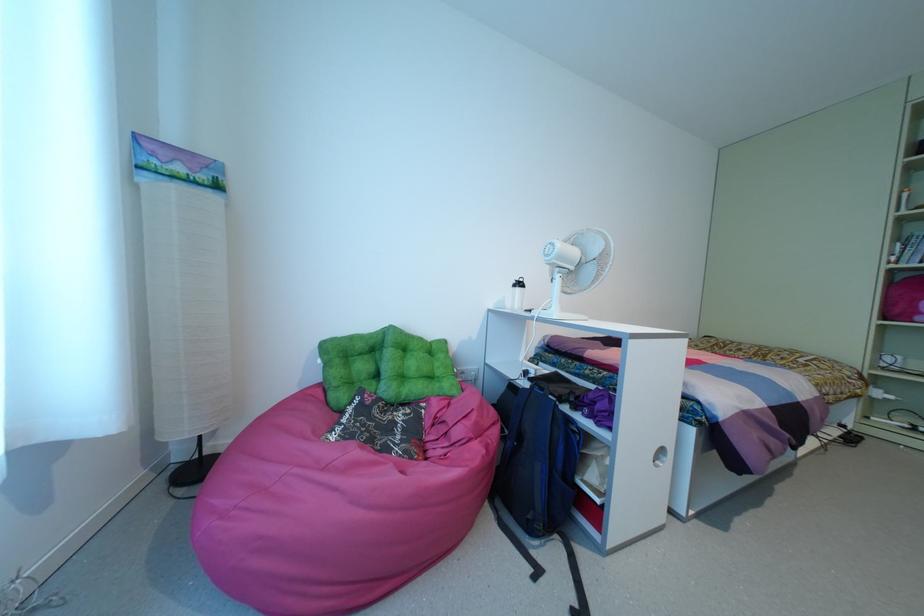
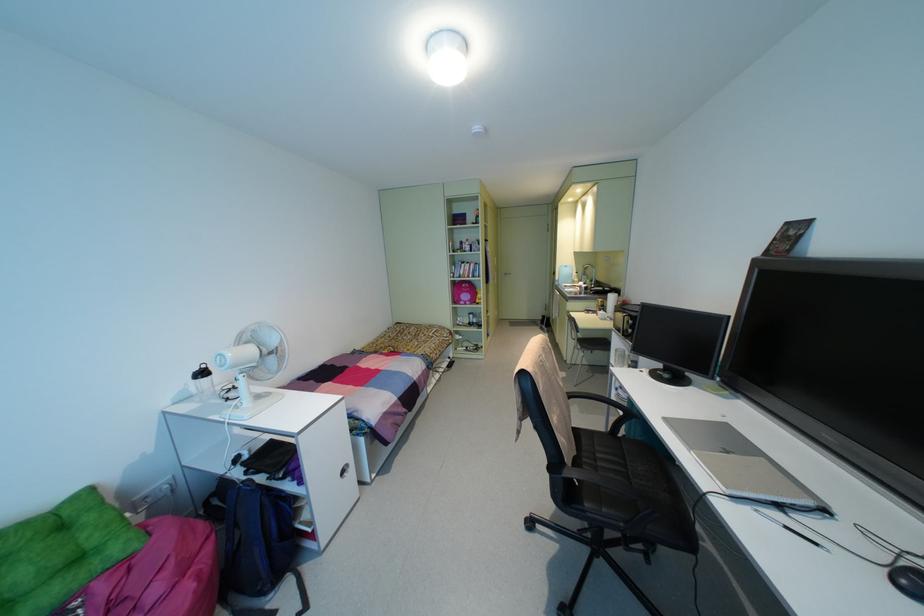
Question: The camera is either moving clockwise (left) or counter-clockwise (right) around the object. The first image is from the beginning of the video and the second image is from the end. Is the camera moving left or right when shooting the video?

Choices:
 (A) Left
 (B) Right

Answer: (A)